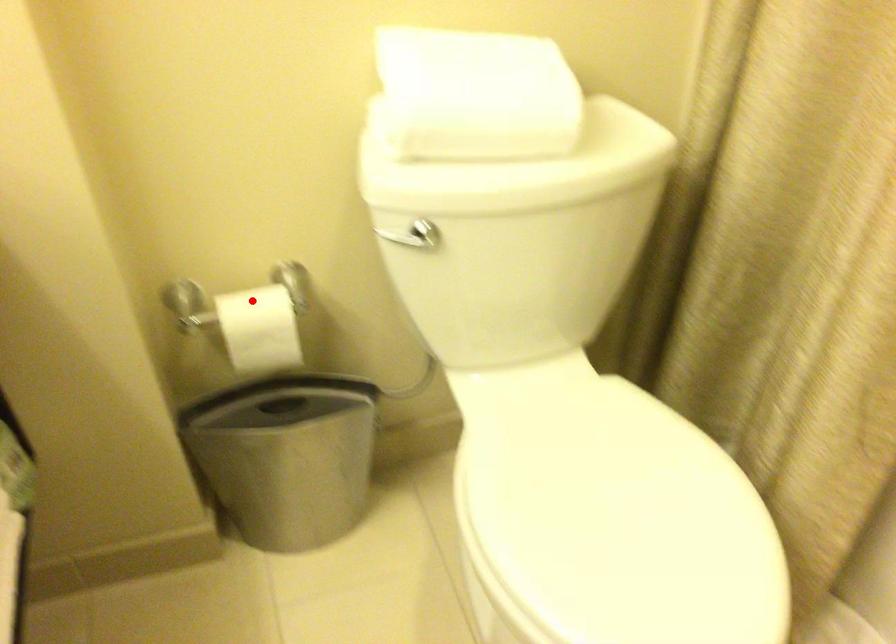
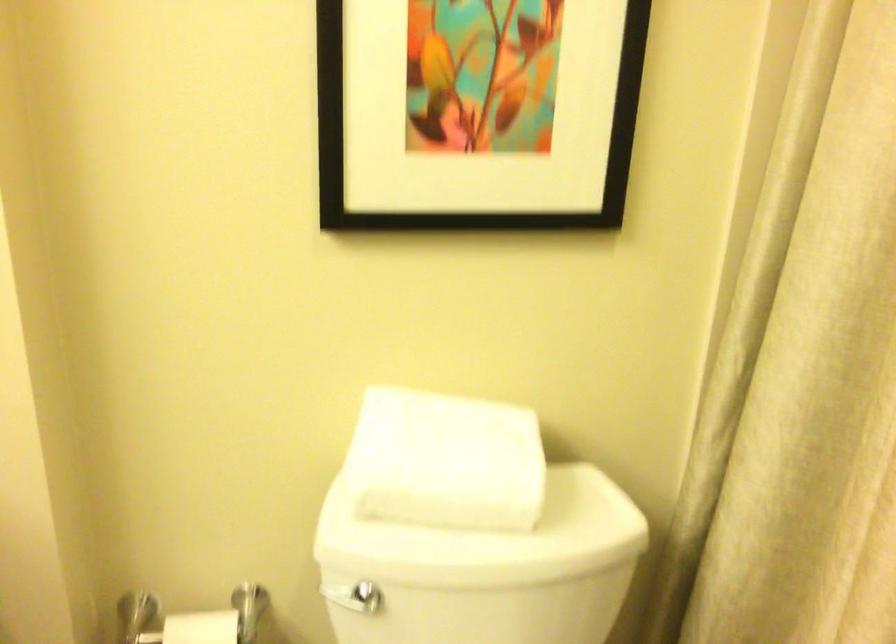
Question: I am providing you with two images of the same scene from different viewpoints. A red point is marked on the first image. Can you still see the location of the red point in image 2?

Choices:
 (A) Yes
 (B) No

Answer: (A)